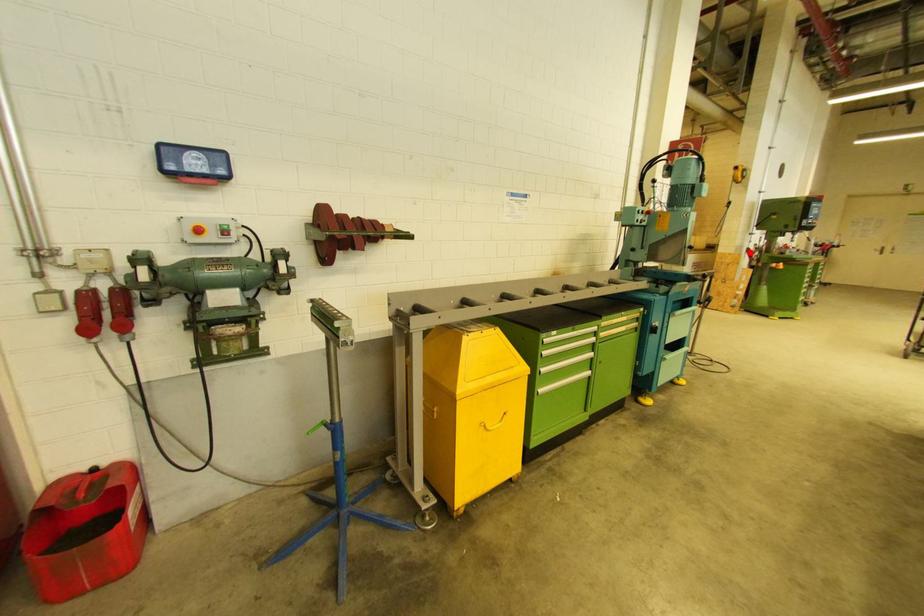
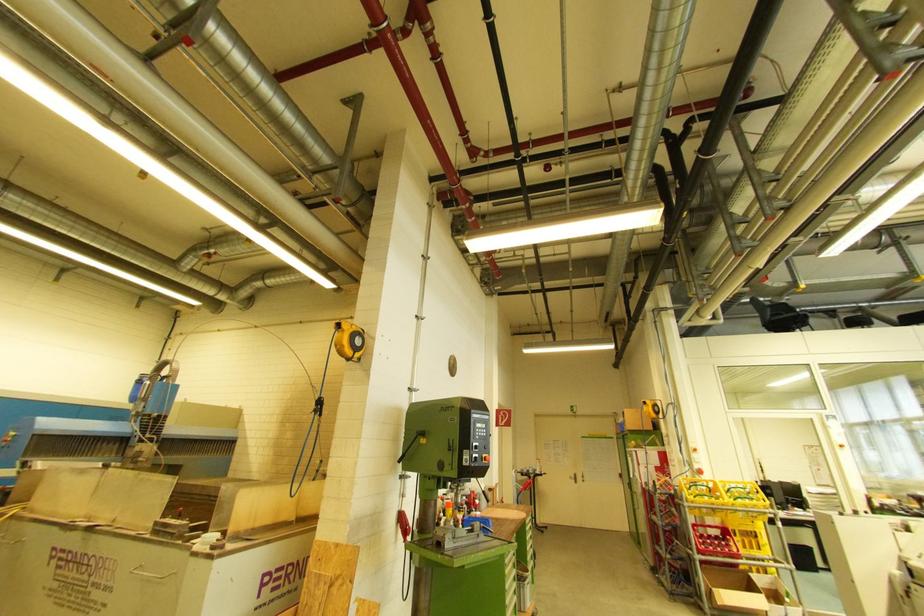
Locate, in the second image, the point that corresponds to the highlighted location in the first image.

(404, 519)